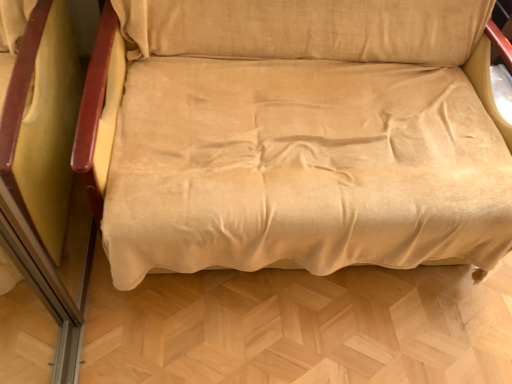
Where is `beige suede armchair at center`? This screenshot has width=512, height=384. beige suede armchair at center is located at coordinates (295, 135).

Image resolution: width=512 pixels, height=384 pixels. What do you see at coordinates (295, 135) in the screenshot?
I see `beige suede armchair at center` at bounding box center [295, 135].

Identify the location of beige suede armchair at center. The width and height of the screenshot is (512, 384). 295,135.